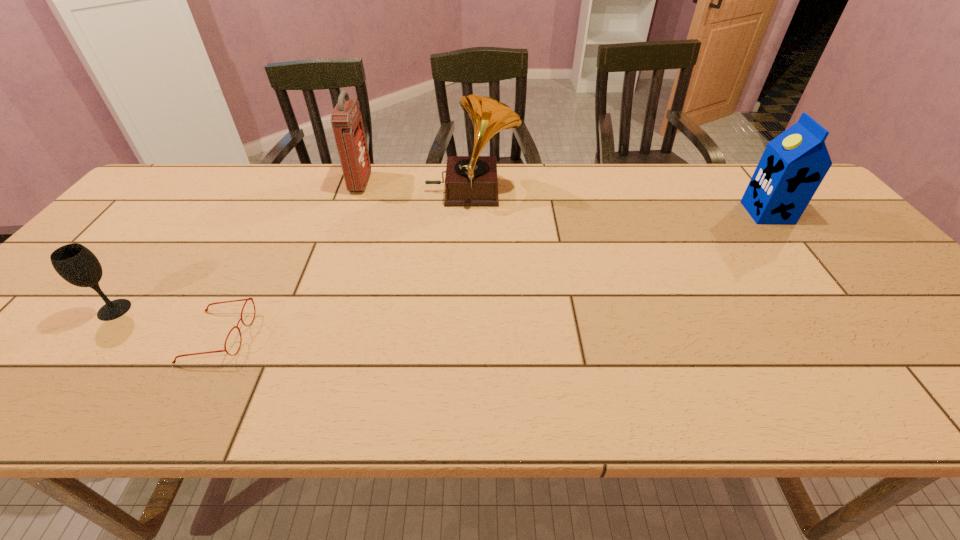
The height and width of the screenshot is (540, 960). In order to click on vacant area at the far edge in this screenshot , I will do `click(632, 187)`.

Find the location of a particular element. The height and width of the screenshot is (540, 960). vacant space at the near edge of the desktop is located at coordinates (495, 385).

Locate an element on the screen. free location at the left edge is located at coordinates (188, 206).

This screenshot has width=960, height=540. Find the location of `vacant area at the right edge of the desktop`. vacant area at the right edge of the desktop is located at coordinates (831, 254).

Locate an element on the screen. This screenshot has width=960, height=540. vacant point located between the leftmost object and the first-aid kit is located at coordinates tap(237, 246).

What are the coordinates of `free area in between the carton and the third object from right to left` in the screenshot? It's located at pos(564,198).

I want to click on free space between the rightmost object and the third object from left to right, so point(564,198).

At what (x,y) coordinates should I click in order to perform the action: click on free space that is in between the third object from right to left and the carton. Please return your answer as a coordinate pair (x, y). Looking at the image, I should click on (564, 198).

I want to click on free space between the third object from right to left and the fourth object from left to right, so click(416, 188).

Image resolution: width=960 pixels, height=540 pixels. Find the location of `free spot between the second shortest object and the shortest object`. free spot between the second shortest object and the shortest object is located at coordinates (166, 323).